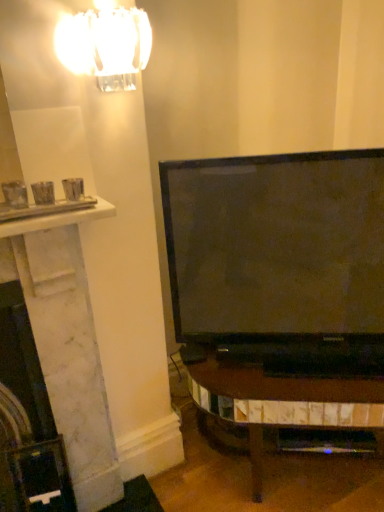
Question: Is the surface of white marble fireplace at left in direct contact with clear glass chandelier at upper left?

Choices:
 (A) no
 (B) yes

Answer: (A)

Question: Considering the relative sizes of white marble fireplace at left and clear glass chandelier at upper left in the image provided, is white marble fireplace at left bigger than clear glass chandelier at upper left?

Choices:
 (A) no
 (B) yes

Answer: (B)

Question: Considering the relative sizes of white marble fireplace at left and clear glass chandelier at upper left in the image provided, is white marble fireplace at left thinner than clear glass chandelier at upper left?

Choices:
 (A) yes
 (B) no

Answer: (B)

Question: Is white marble fireplace at left not near clear glass chandelier at upper left?

Choices:
 (A) yes
 (B) no

Answer: (B)

Question: Is white marble fireplace at left facing towards clear glass chandelier at upper left?

Choices:
 (A) no
 (B) yes

Answer: (A)

Question: From the image's perspective, is white marble fireplace at left above clear glass chandelier at upper left?

Choices:
 (A) yes
 (B) no

Answer: (B)

Question: Does clear glass chandelier at upper left come in front of white marble fireplace at left?

Choices:
 (A) yes
 (B) no

Answer: (A)

Question: Is clear glass chandelier at upper left turned away from white marble fireplace at left?

Choices:
 (A) yes
 (B) no

Answer: (B)

Question: Is clear glass chandelier at upper left at the right side of white marble fireplace at left?

Choices:
 (A) yes
 (B) no

Answer: (A)

Question: Does clear glass chandelier at upper left come behind white marble fireplace at left?

Choices:
 (A) yes
 (B) no

Answer: (B)

Question: From the image's perspective, does clear glass chandelier at upper left appear lower than white marble fireplace at left?

Choices:
 (A) yes
 (B) no

Answer: (B)

Question: Does clear glass chandelier at upper left turn towards white marble fireplace at left?

Choices:
 (A) yes
 (B) no

Answer: (B)

Question: Looking at the image, does clear glass chandelier at upper left seem bigger or smaller compared to white marble fireplace at left?

Choices:
 (A) small
 (B) big

Answer: (A)